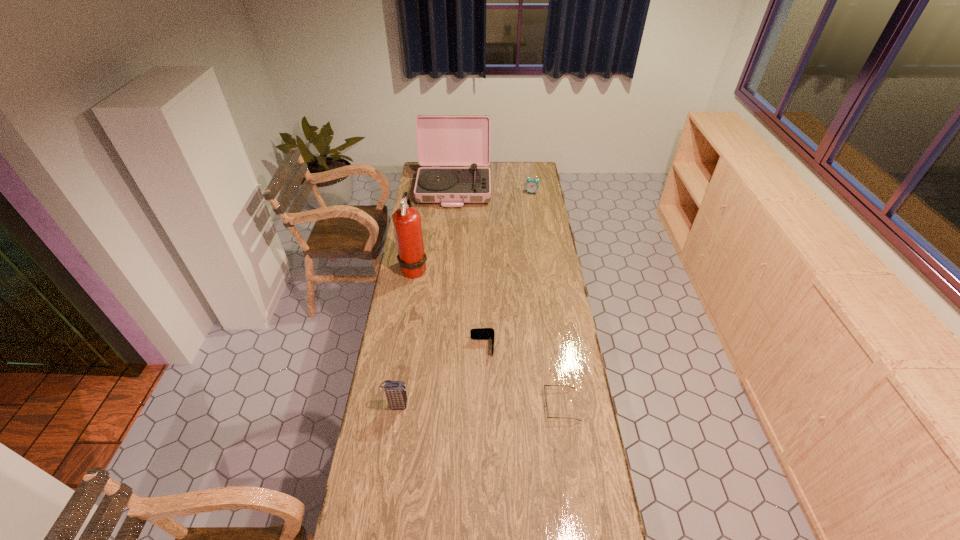
Locate an element on the screen. The image size is (960, 540). free location that satisfies the following two spatial constraints: 1. with the lid open on the second tallest object; 2. at the nozzle of the tallest object is located at coordinates (448, 268).

In order to click on free space that satisfies the following two spatial constraints: 1. on the face of the fourth tallest object; 2. on the outer surface of the second shortest object in this screenshot , I will do `click(555, 347)`.

The width and height of the screenshot is (960, 540). I want to click on free space in the image that satisfies the following two spatial constraints: 1. on the face of the alarm clock; 2. with the zip open on the clutch bag, so click(x=564, y=405).

Where is `vacant space that satisfies the following two spatial constraints: 1. with the lid open on the second tallest object; 2. at the nozzle of the fire extinguisher`? vacant space that satisfies the following two spatial constraints: 1. with the lid open on the second tallest object; 2. at the nozzle of the fire extinguisher is located at coordinates (448, 268).

At what (x,y) coordinates should I click in order to perform the action: click on free location that satisfies the following two spatial constraints: 1. on the face of the third shortest object; 2. at the nozzle of the fire extinguisher. Please return your answer as a coordinate pair (x, y). The height and width of the screenshot is (540, 960). Looking at the image, I should click on (543, 268).

Locate an element on the screen. This screenshot has width=960, height=540. vacant space that satisfies the following two spatial constraints: 1. on the face of the alarm clock; 2. with the zip open on the clutch bag is located at coordinates (564, 405).